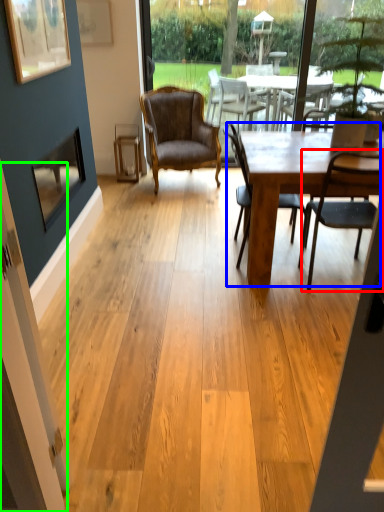
Question: Estimate the real-world distances between objects in this image. Which object is closer to chair (highlighted by a red box), kitchen & dining room table (highlighted by a blue box) or screen door (highlighted by a green box)?

Choices:
 (A) kitchen & dining room table
 (B) screen door

Answer: (A)